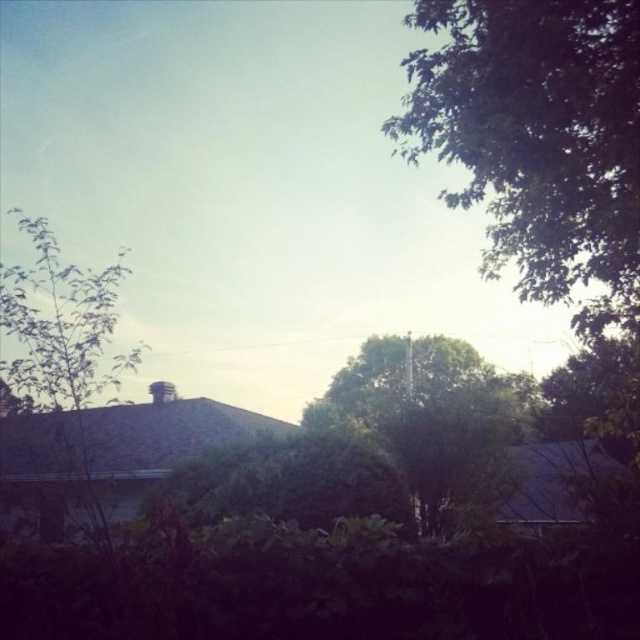
You are standing in the suburban scene and want to place a small garden ornament between the two points, point (561, 36) and point (60, 540). Which point should the ornament be closer to in order to be visible from where you are standing?

The ornament should be closer to point (561, 36) because it is closer to the camera than point (60, 540), making it more visible from your current position.

You are a landscape architect designing a garden path that needs to pass between the green leafy tree at upper right and the green leafy tree at center. Based on their widths, which tree should you consider for allowing more space in the path design?

The green leafy tree at center has a greater width than the green leafy tree at upper right, so you should consider allowing more space for the green leafy tree at center in the path design.

You are a bird looking for a nesting spot. You see the green leafy tree at upper right and the green leafy tree at center. Which tree would you choose if you prefer a larger tree for nesting?

The green leafy tree at upper right is bigger than the green leafy tree at center, so you should choose the green leafy tree at upper right for nesting.